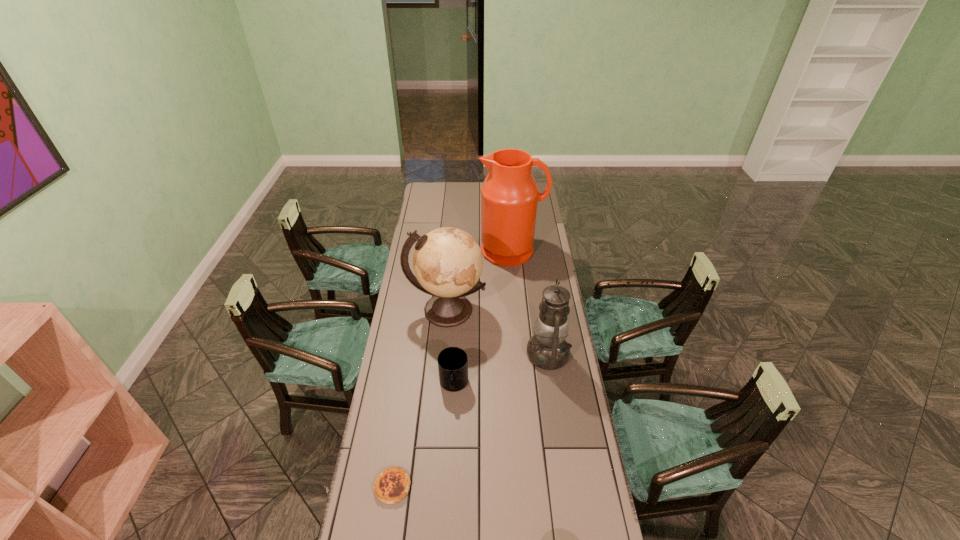
This screenshot has width=960, height=540. Identify the location of vacant space situated 0.190m on the side of the second shortest object with the handle. (450, 449).

The width and height of the screenshot is (960, 540). What are the coordinates of `vacant space situated on the back of the nearest object` in the screenshot? It's located at (405, 401).

Identify the location of globe present at the left edge. (447, 262).

The image size is (960, 540). What are the coordinates of `quiche that is at the left edge` in the screenshot? It's located at (392, 485).

Locate an element on the screen. Image resolution: width=960 pixels, height=540 pixels. water jug that is at the right edge is located at coordinates (509, 195).

Where is `oil lamp that is at the right edge`? This screenshot has height=540, width=960. oil lamp that is at the right edge is located at coordinates (547, 349).

Identify the location of vacant space at the far edge of the desktop. (454, 198).

Where is `vacant space at the left edge`? This screenshot has width=960, height=540. vacant space at the left edge is located at coordinates (420, 215).

Image resolution: width=960 pixels, height=540 pixels. I want to click on free space at the right edge of the desktop, so click(x=564, y=371).

Identify the location of vacant space at the far left corner. (429, 189).